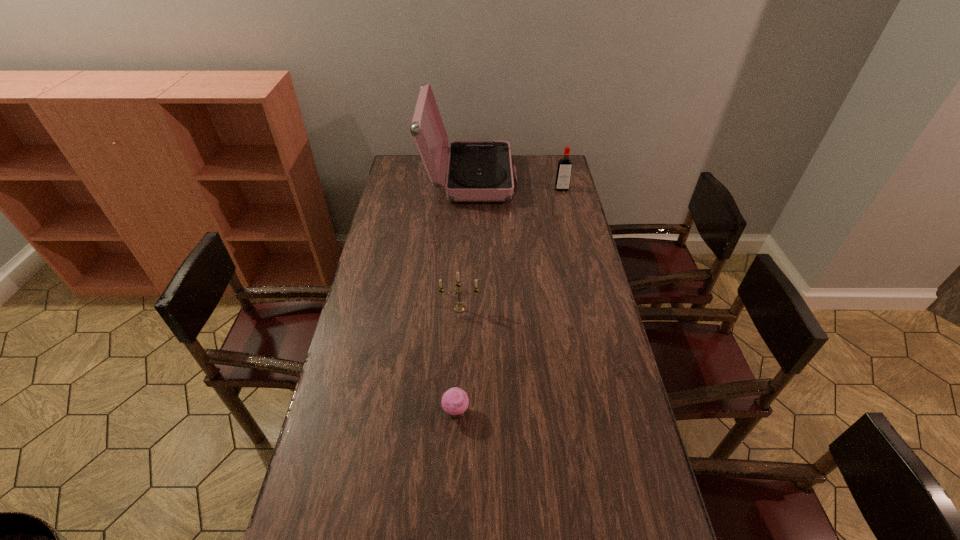
At what (x,y) coordinates should I click in order to perform the action: click on vacant area that lies between the tallest object and the third farthest object. Please return your answer as a coordinate pair (x, y). The width and height of the screenshot is (960, 540). Looking at the image, I should click on point(465,244).

Where is `free space between the fourth farthest object and the rightmost object`? free space between the fourth farthest object and the rightmost object is located at coordinates (509, 300).

Find the location of a particular element. Image resolution: width=960 pixels, height=540 pixels. object identified as the third closest to the nearest object is located at coordinates (478, 171).

Identify which object is located as the second nearest to the shortest object. Please provide its 2D coordinates. Your answer should be formatted as a tuple, i.e. [(x, y)], where the tuple contains the x and y coordinates of a point satisfying the conditions above.

[(459, 308)]